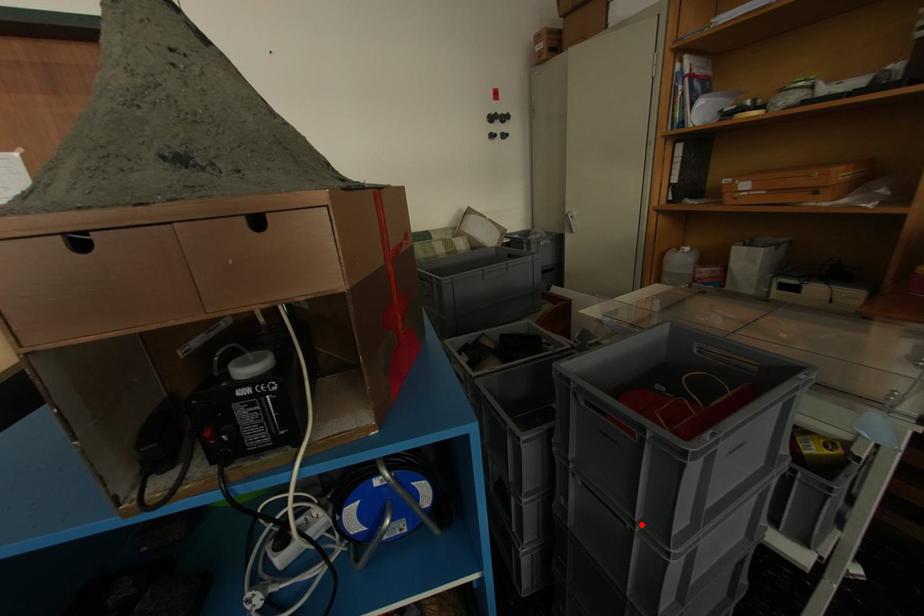
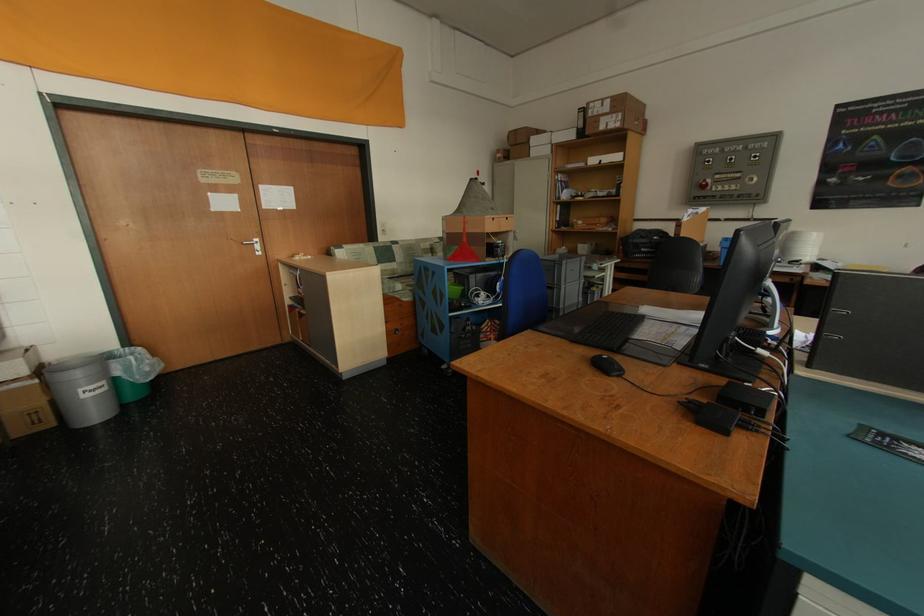
The point at the highlighted location is marked in the first image. Where is the corresponding point in the second image?

(563, 286)